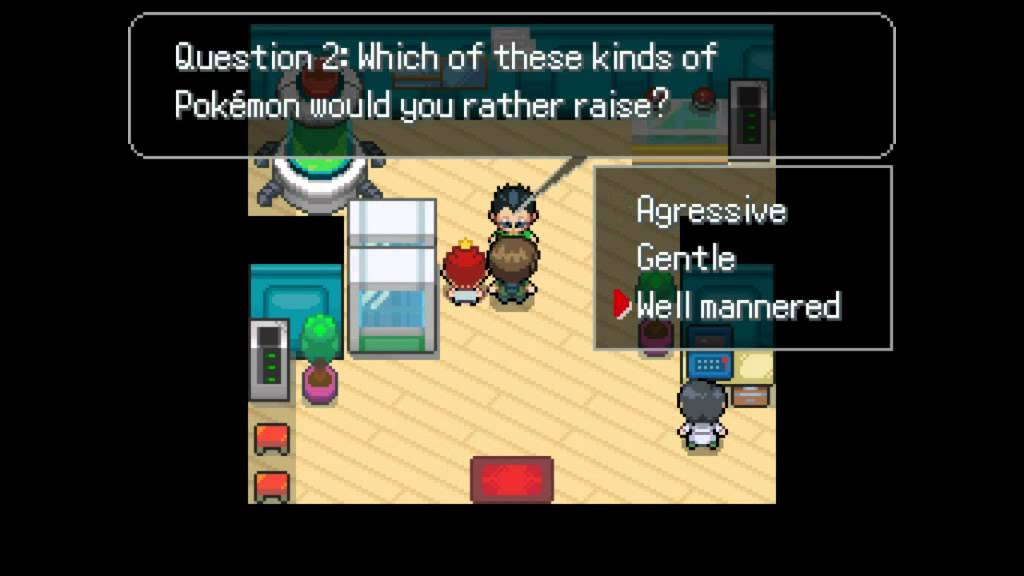
At what (x,y) coordinates should I click in order to perform the action: click on stools. Please return your answer as a coordinate pair (x, y). This screenshot has height=576, width=1024. Looking at the image, I should click on (276, 445), (272, 484).